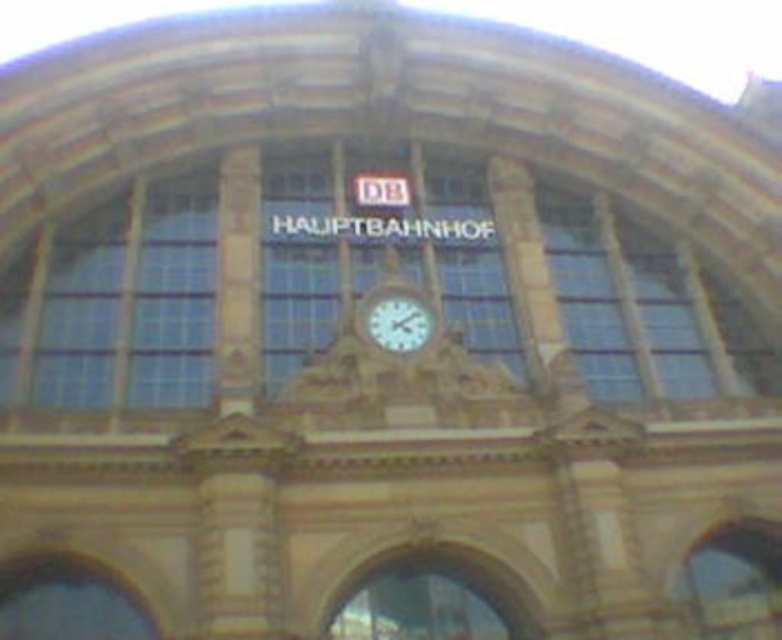
You are standing at the entrance of the Hauptbahnhof train station and notice two points marked on the facade. The first point is located at coordinates point (282, 228) and the second at point (95, 333). From your perspective, which point is closer to you?

Point (95, 333) is closer to you because it is in front of point (282, 228).

You are a visitor at the train station and need to check the time. You see the clear glass window at left and the white glossy clock at center. Which object should you look at to see the time?

The white glossy clock at center shows the time, so you should look at the white glossy clock at center.

You are standing in front of the Hauptbahnhof train station entrance. You notice two points marked on the facade. The first point is located at coordinate point (761,392) and the second at point (415,301). Which point is closer to you?

Point (415,301) is closer to you because it is less further to the camera than point (761,392).